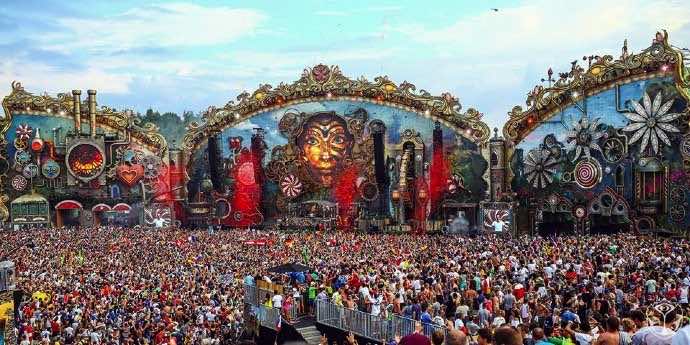
Where is `arched panel`? This screenshot has width=690, height=345. arched panel is located at coordinates (324, 127), (611, 111), (41, 143).